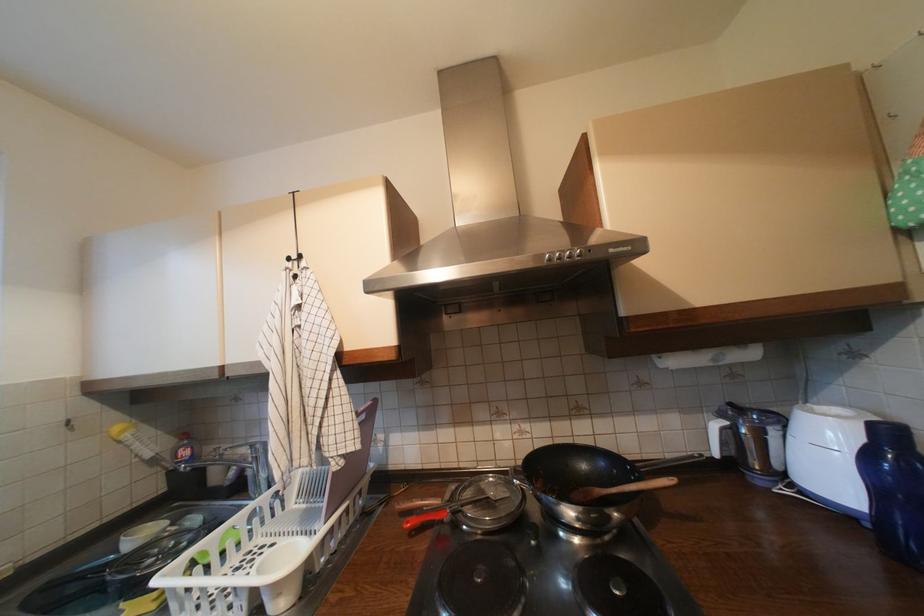
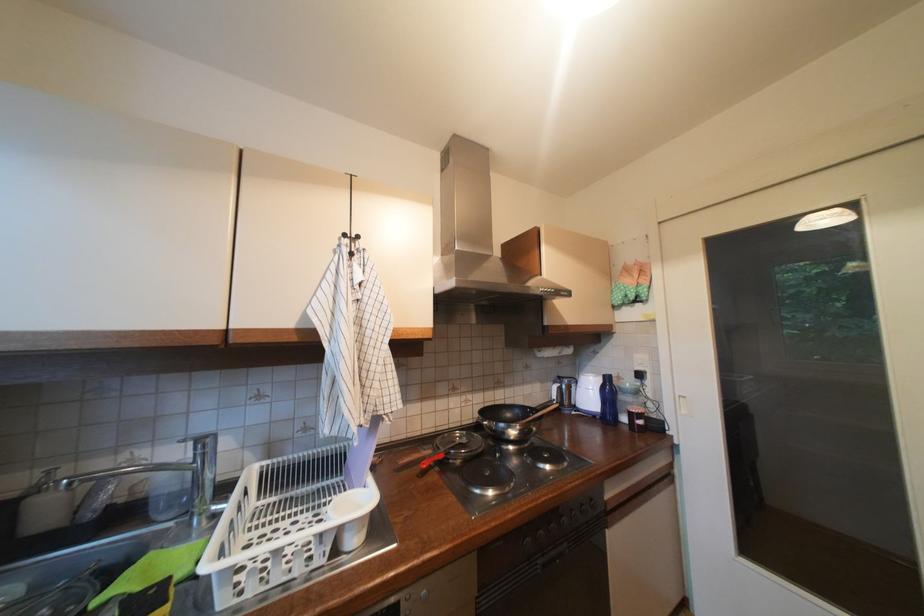
Question: How did the camera likely rotate?

Choices:
 (A) Left
 (B) Right
 (C) Up
 (D) Down

Answer: (B)